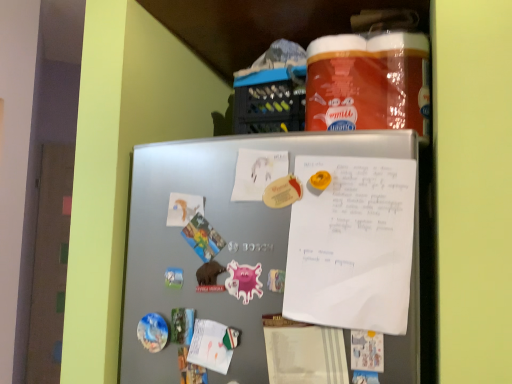
Question: Does white matte paper at upper left, which appears as the second paper when viewed from the right, have a lesser height compared to white matte paper at center, acting as the second paper starting from the bottom?

Choices:
 (A) yes
 (B) no

Answer: (A)

Question: From the image's perspective, is white matte paper at upper left, the 2th paper when ordered from top to bottom, below white matte paper at center, acting as the 2th paper starting from the left?

Choices:
 (A) no
 (B) yes

Answer: (B)

Question: Is white matte paper at upper left, which is counted as the 1th paper, starting from the bottom, surrounding white matte paper at center, acting as the 2th paper starting from the left?

Choices:
 (A) no
 (B) yes

Answer: (A)

Question: Does white matte paper at upper left, which is counted as the 1th paper, starting from the bottom, have a lesser width compared to white matte paper at center, the 1th paper when ordered from top to bottom?

Choices:
 (A) yes
 (B) no

Answer: (B)

Question: Is white matte paper at upper left, which is the 1th paper in left-to-right order, next to white matte paper at center, the first paper from the right?

Choices:
 (A) no
 (B) yes

Answer: (A)

Question: Is white matte paper at upper left, which is counted as the 1th paper, starting from the bottom, outside of white matte paper at center, acting as the second paper starting from the bottom?

Choices:
 (A) no
 (B) yes

Answer: (B)

Question: Considering the relative positions of white matte paper at center, acting as the second paper starting from the bottom, and white paper at upper center in the image provided, is white matte paper at center, acting as the second paper starting from the bottom, to the right of white paper at upper center from the viewer's perspective?

Choices:
 (A) no
 (B) yes

Answer: (A)

Question: From a real-world perspective, is white matte paper at center, the 1th paper when ordered from top to bottom, physically above white paper at upper center?

Choices:
 (A) yes
 (B) no

Answer: (A)

Question: Is white matte paper at center, the first paper from the right, located outside white paper at upper center?

Choices:
 (A) no
 (B) yes

Answer: (B)

Question: Is white matte paper at center, the first paper from the right, next to white paper at upper center?

Choices:
 (A) no
 (B) yes

Answer: (A)

Question: Does white matte paper at center, acting as the second paper starting from the bottom, have a greater height compared to white paper at upper center?

Choices:
 (A) no
 (B) yes

Answer: (A)

Question: From the image's perspective, is white matte paper at center, the first paper from the right, on white paper at upper center?

Choices:
 (A) no
 (B) yes

Answer: (B)

Question: From a real-world perspective, is white paper at upper center located beneath satin silver fridge at center?

Choices:
 (A) yes
 (B) no

Answer: (B)